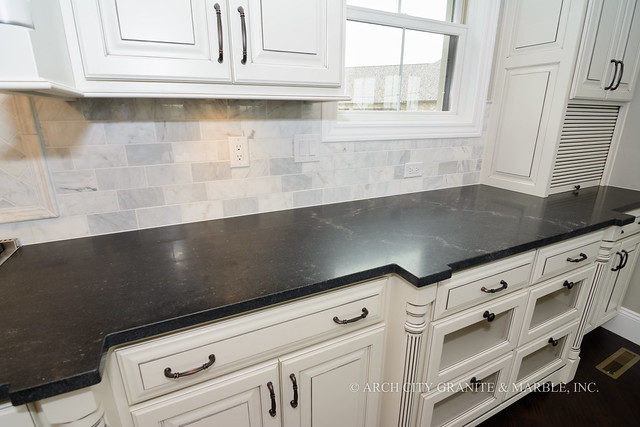
The image size is (640, 427). I want to click on light colored object on left corner of counter, so click(9, 241).